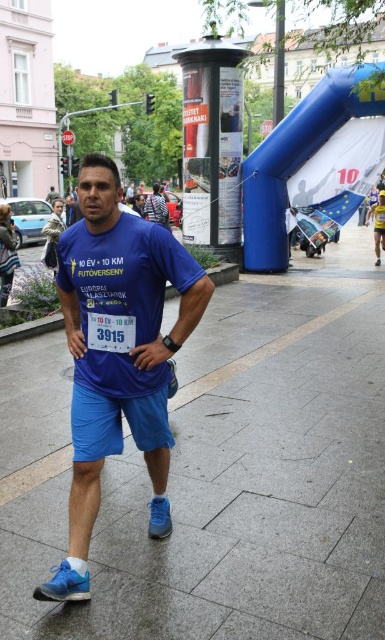
Which is below, blue matte t-shirt at center or yellow fabric runner at right?

blue matte t-shirt at center

Does blue matte t-shirt at center appear over yellow fabric runner at right?

Actually, blue matte t-shirt at center is below yellow fabric runner at right.

Is point (87, 348) positioned in front of point (379, 253)?

Yes, it is in front of point (379, 253).

Identify the location of blue matte t-shirt at center. (122, 298).

Is blue fabric shirt at center bigger than blue suede running shoe at lower left?

Correct, blue fabric shirt at center is larger in size than blue suede running shoe at lower left.

Measure the distance from blue fabric shirt at center to blue suede running shoe at lower left.

27.39 inches

Between point (95, 371) and point (155, 496), which one is positioned in front?

Positioned in front is point (95, 371).

This screenshot has height=640, width=385. What are the coordinates of `blue fabric shirt at center` in the screenshot? It's located at (118, 337).

The height and width of the screenshot is (640, 385). Describe the element at coordinates (122, 298) in the screenshot. I see `blue matte t-shirt at center` at that location.

Is point (88, 323) positioned in front of point (165, 516)?

That is True.

Is point (145, 292) farther from viewer compared to point (152, 529)?

That is False.

The image size is (385, 640). I want to click on blue matte t-shirt at center, so click(122, 298).